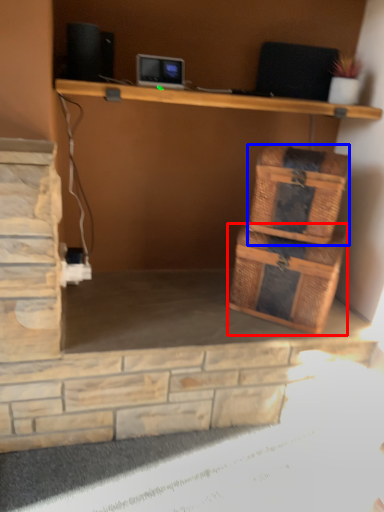
Question: Among these objects, which one is farthest to the camera, storage box (highlighted by a red box) or basket (highlighted by a blue box)?

Choices:
 (A) storage box
 (B) basket

Answer: (A)